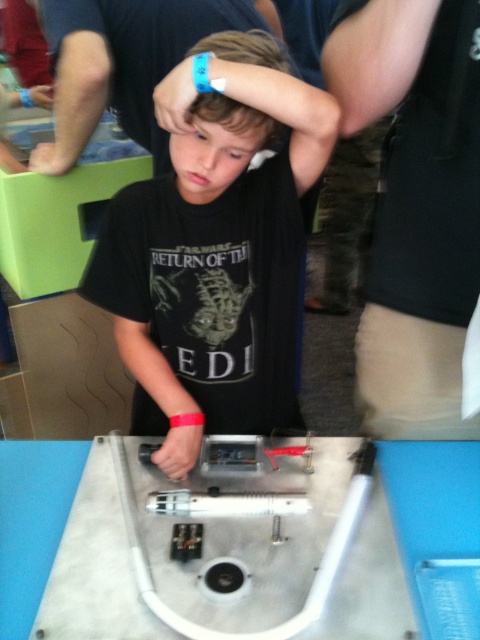
Who is shorter, black matte shirt at center or silver metallic lightsaber at center?

Standing shorter between the two is silver metallic lightsaber at center.

Is black matte shirt at center shorter than silver metallic lightsaber at center?

Incorrect, black matte shirt at center's height does not fall short of silver metallic lightsaber at center's.

Between point (177, 321) and point (132, 502), which one is positioned in front?

Point (132, 502)

Where is `black matte shirt at center`? The image size is (480, 640). black matte shirt at center is located at coordinates (216, 253).

Between point (186, 1) and point (365, 458), which one is positioned behind?

Positioned behind is point (186, 1).

Between point (157, 26) and point (362, 504), which one is positioned in front?

Point (362, 504) is more forward.

Image resolution: width=480 pixels, height=640 pixels. Identify the location of blue wristband at upper center. (123, 64).

In order to click on blue wristband at upper center in this screenshot , I will do `click(123, 64)`.

Between blue wristband at upper center and matte black head at upper center, which one is positioned lower?

matte black head at upper center

Between blue wristband at upper center and matte black head at upper center, which one appears on the left side from the viewer's perspective?

Positioned to the left is blue wristband at upper center.

You are a GUI agent. You are given a task and a screenshot of the screen. Output one action in this format:
    pyautogui.click(x=<x>, y=<y>)
    Task: Click on the blue wristband at upper center
    This screenshot has width=480, height=640.
    Given the screenshot: What is the action you would take?
    pyautogui.click(x=123, y=64)